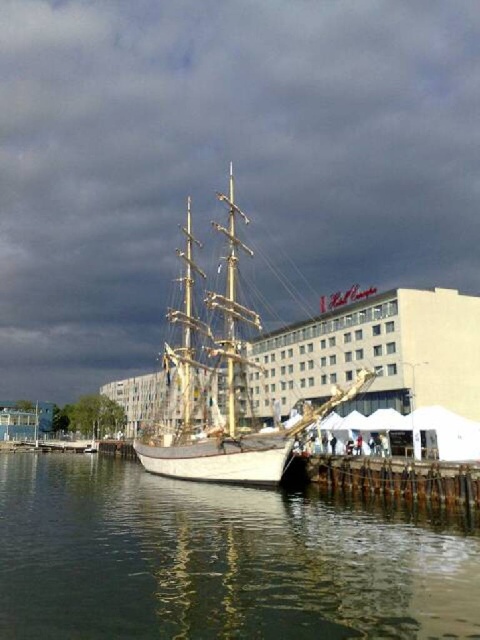
Question: Which point is closer to the camera?

Choices:
 (A) (477, 534)
 (B) (192, 304)
 (C) (459, 500)

Answer: (A)

Question: Which object is positioned closest to the clear water at lower center?

Choices:
 (A) white wooden ship at center
 (B) wooden at lower right

Answer: (B)

Question: Is clear water at lower center to the right of wooden at lower right from the viewer's perspective?

Choices:
 (A) yes
 (B) no

Answer: (B)

Question: Is clear water at lower center behind wooden at lower right?

Choices:
 (A) no
 (B) yes

Answer: (A)

Question: Which object is closer to the camera taking this photo?

Choices:
 (A) white wooden ship at center
 (B) clear water at lower center
 (C) wooden at lower right

Answer: (B)

Question: In this image, where is white wooden ship at center located relative to wooden at lower right?

Choices:
 (A) below
 (B) above

Answer: (B)